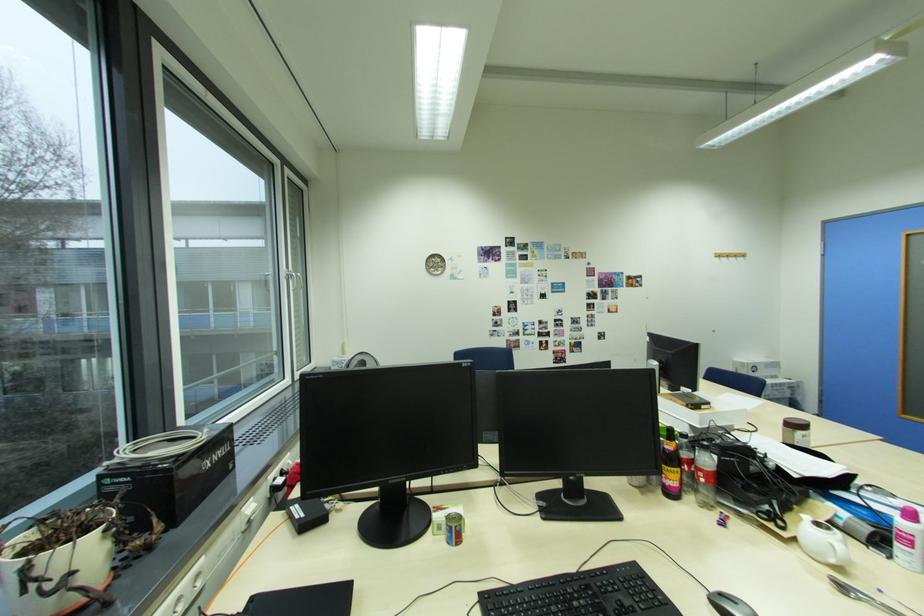
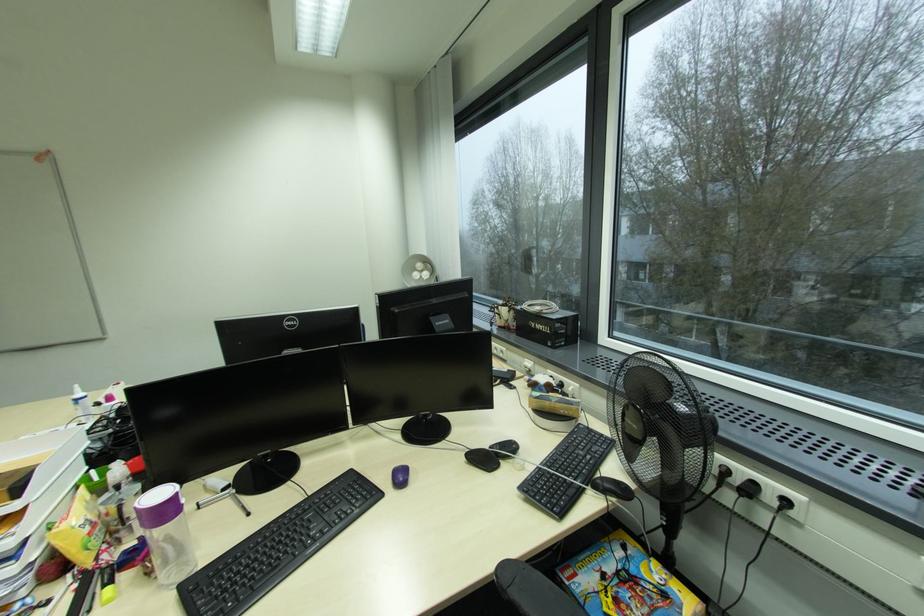
Question: I am providing you with two images of the same scene from different viewpoints. After the viewpoint changes to image2, which objects are now occluded?

Choices:
 (A) computer mouse
 (B) purple container lid
 (C) stove hood button
 (D) black computer mouse

Answer: (A)